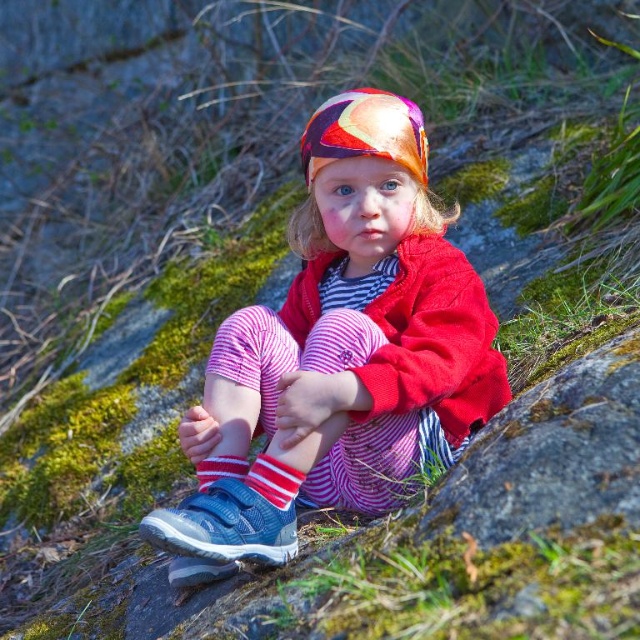
You are a fashion designer observing the child in the image. You need to determine if the striped cotton pants at center can be paired with the striped cotton sock at lower center based on their positions. Can they be worn together?

The striped cotton pants at center is taller than striped cotton sock at lower center, so yes, they can be worn together as the pants will cover the socks appropriately.

You are a photographer trying to capture the child in the scene. You have two markers at coordinates point (x=356, y=131) and point (x=237, y=460). Which marker is closer to the child?

Point (x=356, y=131) is closer to the viewer than point (x=237, y=460), so the marker at point (x=356, y=131) is closer to the child.